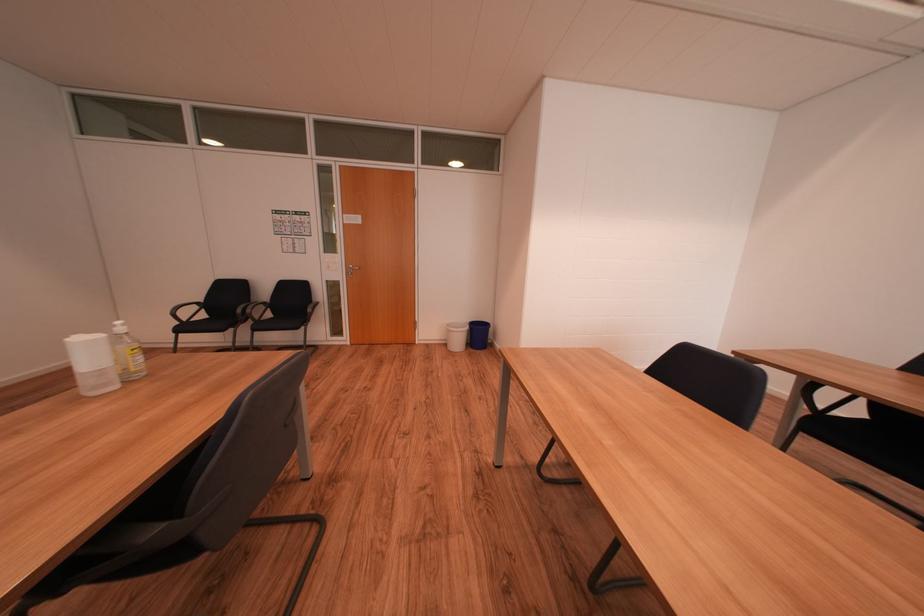
What do you see at coordinates (127, 353) in the screenshot? I see `the clear bottle pump` at bounding box center [127, 353].